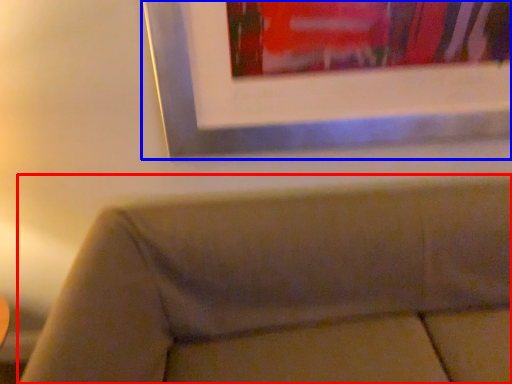
Question: Which object is closer to the camera taking this photo, studio couch (highlighted by a red box) or picture frame (highlighted by a blue box)?

Choices:
 (A) studio couch
 (B) picture frame

Answer: (A)